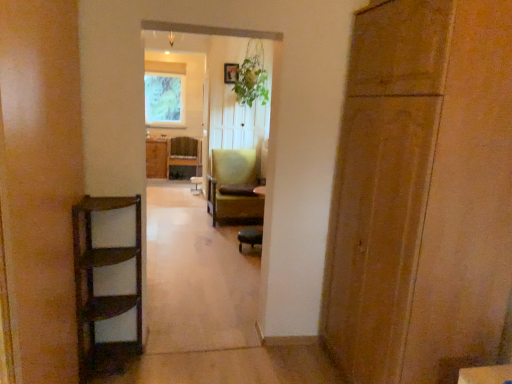
Question: Is wooden chair at center, acting as the third chair starting from the front, facing away from green fabric chair at center, the 2th chair from the right?

Choices:
 (A) yes
 (B) no

Answer: (B)

Question: Does wooden chair at center, acting as the third chair starting from the front, appear on the left side of green fabric chair at center, which is the second chair in left-to-right order?

Choices:
 (A) yes
 (B) no

Answer: (A)

Question: Is wooden chair at center, acting as the third chair starting from the front, oriented towards green fabric chair at center, the 2th chair from the right?

Choices:
 (A) yes
 (B) no

Answer: (A)

Question: From the image's perspective, would you say wooden chair at center, arranged as the first chair when viewed from the left, is positioned over green fabric chair at center, the 2th chair from the right?

Choices:
 (A) yes
 (B) no

Answer: (A)

Question: Is wooden chair at center, arranged as the first chair when viewed from the left, far away from green fabric chair at center, positioned as the 2th chair in front-to-back order?

Choices:
 (A) yes
 (B) no

Answer: (A)

Question: Is green leafy plant at center to the left or to the right of matte brown cabinet at center in the image?

Choices:
 (A) left
 (B) right

Answer: (B)

Question: From a real-world perspective, is green leafy plant at center positioned above or below matte brown cabinet at center?

Choices:
 (A) above
 (B) below

Answer: (A)

Question: In terms of width, does green leafy plant at center look wider or thinner when compared to matte brown cabinet at center?

Choices:
 (A) wide
 (B) thin

Answer: (A)

Question: Relative to matte brown cabinet at center, is green leafy plant at center in front or behind?

Choices:
 (A) front
 (B) behind

Answer: (A)

Question: Considering the positions of point (187, 153) and point (241, 62), is point (187, 153) closer or farther from the camera than point (241, 62)?

Choices:
 (A) farther
 (B) closer

Answer: (A)

Question: From the image's perspective, relative to green leafy plant at center, is wooden chair at center, acting as the first chair starting from the back, above or below?

Choices:
 (A) below
 (B) above

Answer: (A)

Question: From a real-world perspective, relative to green leafy plant at center, is wooden chair at center, arranged as the 3th chair when viewed from the right, vertically above or below?

Choices:
 (A) above
 (B) below

Answer: (B)

Question: Considering the positions of wooden chair at center, acting as the third chair starting from the front, and green leafy plant at center in the image, is wooden chair at center, acting as the third chair starting from the front, taller or shorter than green leafy plant at center?

Choices:
 (A) tall
 (B) short

Answer: (B)

Question: Considering the positions of point (183, 86) and point (260, 211), is point (183, 86) closer or farther from the camera than point (260, 211)?

Choices:
 (A) farther
 (B) closer

Answer: (A)

Question: In the image, is green textured fabric at upper center positioned in front of or behind green fabric chair at center, which is the second chair in left-to-right order?

Choices:
 (A) front
 (B) behind

Answer: (B)